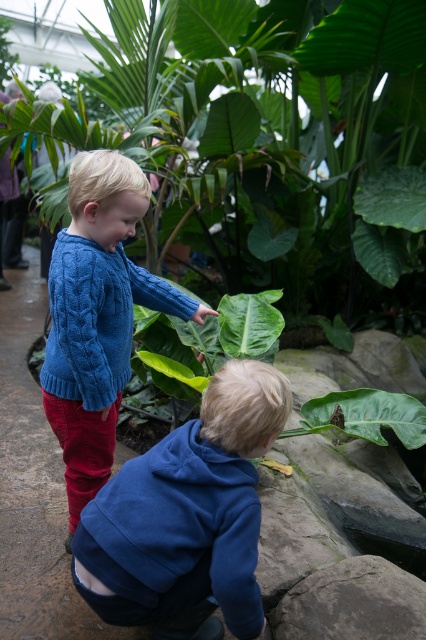
You are standing in the indoor botanical garden and want to take a photo of the green leafy plant at center. If your camera has a maximum focus range of 4 meters, will you be able to capture the plant clearly without moving closer?

The green leafy plant at center and viewer are 4.28 meters apart. Since the distance exceeds the camera maximum focus range of 4 meters, you will not be able to capture the plant clearly without moving closer.

You are a parent trying to take a photo of your two children in the botanical garden. You want to ensure both the green leafy plant at center and the blue fleece jacket at lower center are visible in the frame. Given their sizes, is there a risk that one might block the other from view?

The green leafy plant at center might be wider than the blue fleece jacket at lower center, so there is a possibility that the plant could block the jacket from view if they are positioned close together in the frame.